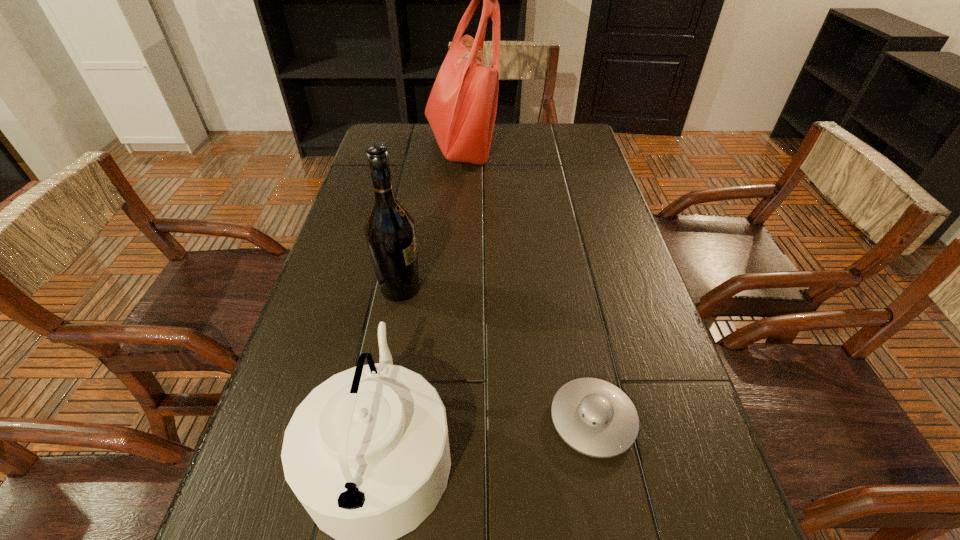
You are a GUI agent. You are given a task and a screenshot of the screen. Output one action in this format:
    pyautogui.click(x=<x>, y=<y>)
    Task: Click on the farthest object
    This screenshot has width=960, height=540.
    Given the screenshot: What is the action you would take?
    pyautogui.click(x=461, y=110)

I want to click on the tallest object, so click(461, 110).

Where is `the second farthest object`? the second farthest object is located at coordinates (390, 232).

This screenshot has height=540, width=960. Identify the location of the second tallest object. (390, 232).

Identify the location of the shortest object. (594, 417).

Locate an element on the screen. The height and width of the screenshot is (540, 960). the rightmost object is located at coordinates (594, 417).

You are a GUI agent. You are given a task and a screenshot of the screen. Output one action in this format:
    pyautogui.click(x=<x>, y=<y>)
    Task: Click on the vacant space positioned on the front-facing side of the tallest object
    
    Given the screenshot: What is the action you would take?
    pyautogui.click(x=577, y=146)

At what (x,y) coordinates should I click in order to perform the action: click on free space located 0.370m on the label of the third shortest object. Please return your answer as a coordinate pair (x, y). Looking at the image, I should click on (587, 289).

Where is `blank space located 0.070m on the left of the shortest object`? This screenshot has width=960, height=540. blank space located 0.070m on the left of the shortest object is located at coordinates (511, 420).

Locate an element on the screen. The height and width of the screenshot is (540, 960). object that is at the far edge is located at coordinates 461,110.